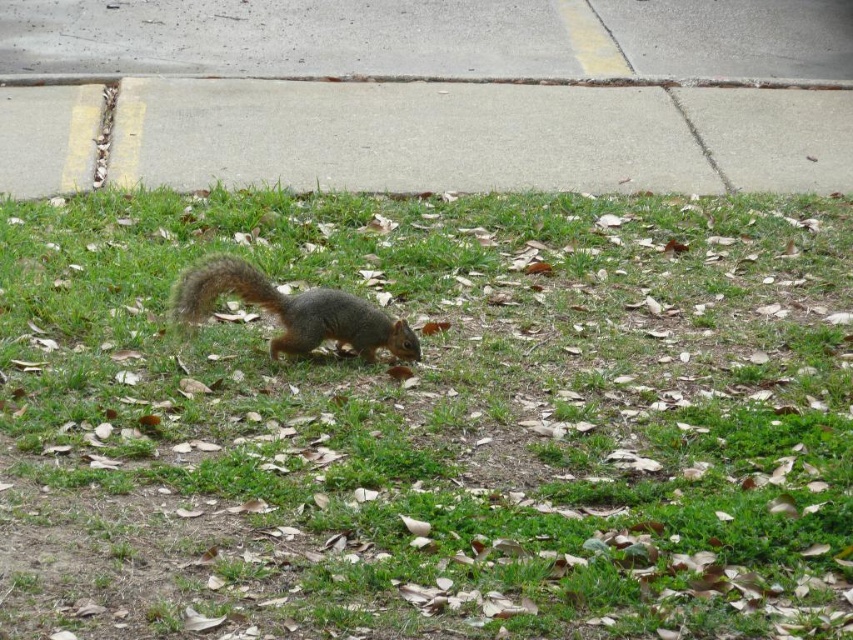
Where is `gray concrete curb at upper center`? The image size is (853, 640). gray concrete curb at upper center is located at coordinates (570, 81).

Can you confirm if gray concrete curb at upper center is shorter than fuzzy brown tail at center?

Correct, gray concrete curb at upper center is not as tall as fuzzy brown tail at center.

Measure the distance between point [3,83] and camera.

7.87 meters

This screenshot has width=853, height=640. In order to click on gray concrete curb at upper center in this screenshot , I will do `click(570, 81)`.

Describe the element at coordinates (430, 420) in the screenshot. I see `green grass at center` at that location.

This screenshot has height=640, width=853. I want to click on green grass at center, so click(x=430, y=420).

Who is taller, gray-furred squirrel at center or fuzzy brown tail at center?

gray-furred squirrel at center is taller.

What do you see at coordinates (292, 310) in the screenshot? The width and height of the screenshot is (853, 640). I see `gray-furred squirrel at center` at bounding box center [292, 310].

The image size is (853, 640). What do you see at coordinates (292, 310) in the screenshot? I see `gray-furred squirrel at center` at bounding box center [292, 310].

Locate an element on the screen. The image size is (853, 640). gray-furred squirrel at center is located at coordinates (292, 310).